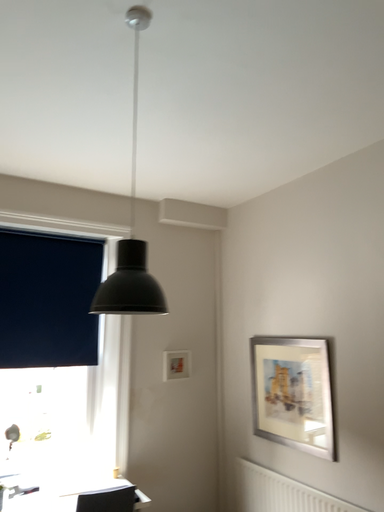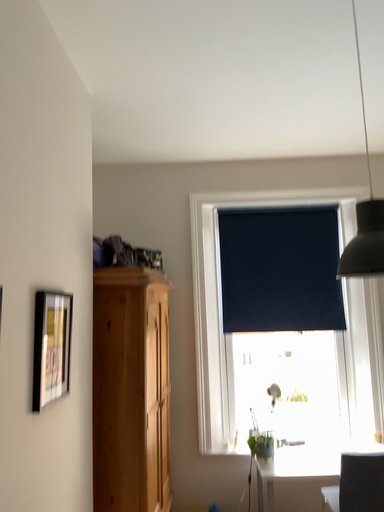
Question: Which way did the camera rotate in the video?

Choices:
 (A) rotated left
 (B) rotated right

Answer: (A)